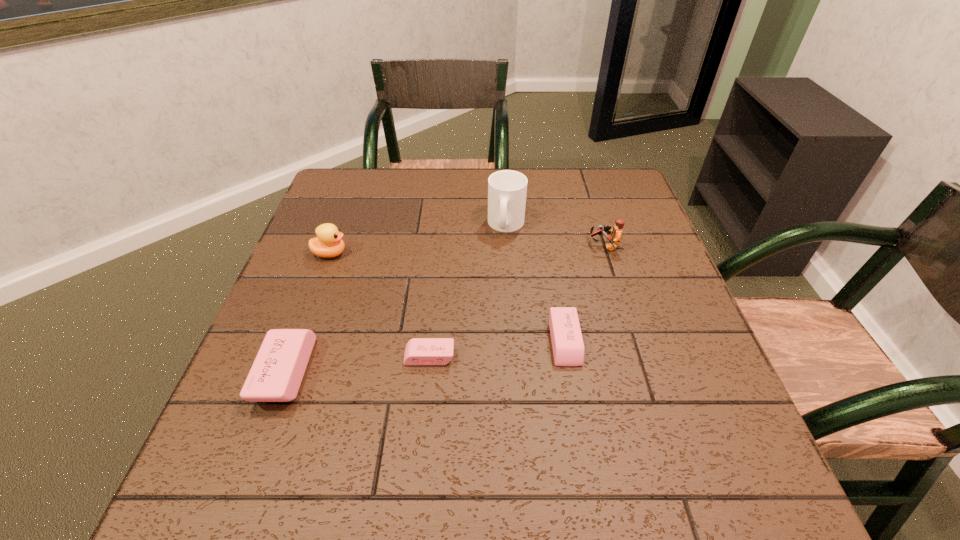
Where is `unoccupied area between the duckling and the second tallest eraser`? unoccupied area between the duckling and the second tallest eraser is located at coordinates (447, 298).

Where is `object that is the fifth closest to the fourth tallest object`? The image size is (960, 540). object that is the fifth closest to the fourth tallest object is located at coordinates (616, 234).

Find the location of `object that ranks as the third closest to the Lego`. object that ranks as the third closest to the Lego is located at coordinates (419, 351).

At what (x,y) coordinates should I click in order to perform the action: click on the second closest eraser to the tallest object. Please return your answer as a coordinate pair (x, y). Image resolution: width=960 pixels, height=540 pixels. Looking at the image, I should click on (419, 351).

Find the location of `the second closest eraser to the tallest eraser`. the second closest eraser to the tallest eraser is located at coordinates (567, 343).

You are a GUI agent. You are given a task and a screenshot of the screen. Output one action in this format:
    pyautogui.click(x=<x>, y=<y>)
    Task: Click on the free location that satisfies the following two spatial constraints: 1. on the face of the duckling; 2. on the back side of the second shortest object
    
    Given the screenshot: What is the action you would take?
    coord(298,342)

You are a GUI agent. You are given a task and a screenshot of the screen. Output one action in this format:
    pyautogui.click(x=<x>, y=<y>)
    Task: Click on the vacant space that satisfies the following two spatial constraints: 1. on the face of the second eraser from right to left; 2. on the left side of the duckling
    Image resolution: width=960 pixels, height=540 pixels.
    Given the screenshot: What is the action you would take?
    pyautogui.click(x=292, y=356)

Identify the location of free space that satisfies the following two spatial constraints: 1. on the face of the shortest eraser; 2. on the right side of the duckling. This screenshot has height=540, width=960. (292, 356).

Image resolution: width=960 pixels, height=540 pixels. What are the coordinates of `free space that satisfies the following two spatial constraints: 1. on the handle side of the tallest object; 2. on the face of the duckling` in the screenshot? It's located at (508, 253).

Identify the location of vacant area in the image that satisfies the following two spatial constraints: 1. on the handle side of the third object from right to left; 2. on the face of the duckling. The width and height of the screenshot is (960, 540). (508, 253).